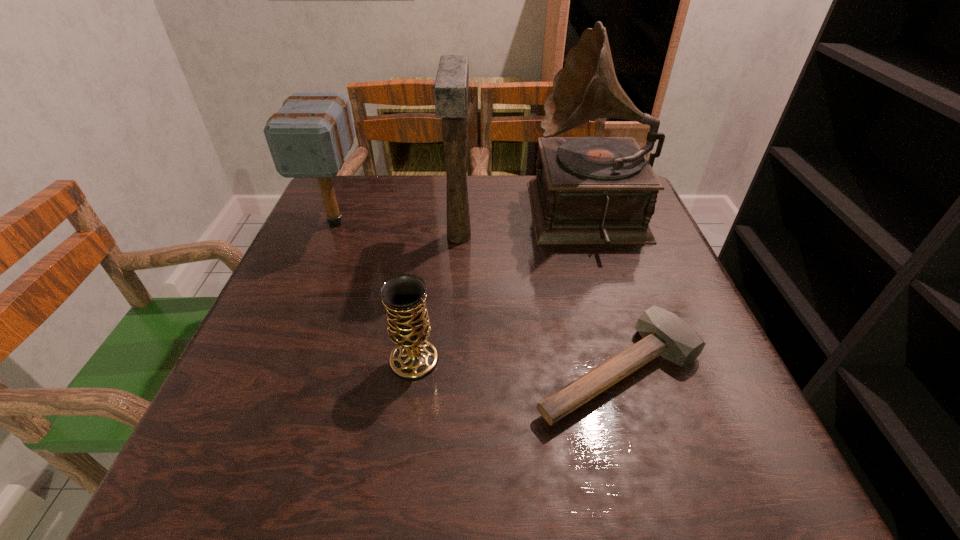
Where is `vacant area that lies between the tallest mallet and the record player`? vacant area that lies between the tallest mallet and the record player is located at coordinates (524, 227).

Image resolution: width=960 pixels, height=540 pixels. In order to click on empty space that is in between the leftmost object and the shortest object in this screenshot , I will do `click(477, 296)`.

This screenshot has height=540, width=960. In order to click on unoccupied position between the tallest mallet and the record player in this screenshot , I will do 524,227.

Locate an element on the screen. free space between the fourth tallest object and the third shortest object is located at coordinates point(375,291).

Identify the location of free space between the second shortest mallet and the second shortest object. The height and width of the screenshot is (540, 960). (375, 291).

At what (x,y) coordinates should I click in order to perform the action: click on object that is the third closest to the chalice. Please return your answer as a coordinate pair (x, y). The height and width of the screenshot is (540, 960). Looking at the image, I should click on (588, 190).

Locate an element on the screen. object that can be found as the second closest to the record player is located at coordinates (664, 333).

I want to click on the third closest mallet to the record player, so click(309, 137).

This screenshot has height=540, width=960. I want to click on mallet object that ranks as the second closest to the chalice, so click(451, 86).

At what (x,y) coordinates should I click in order to perform the action: click on vacant space that satisfies the following two spatial constraints: 1. on the front side of the nearest mallet; 2. on the left side of the second mallet from right to left. Please return your answer as a coordinate pair (x, y). This screenshot has height=540, width=960. Looking at the image, I should click on (451, 371).